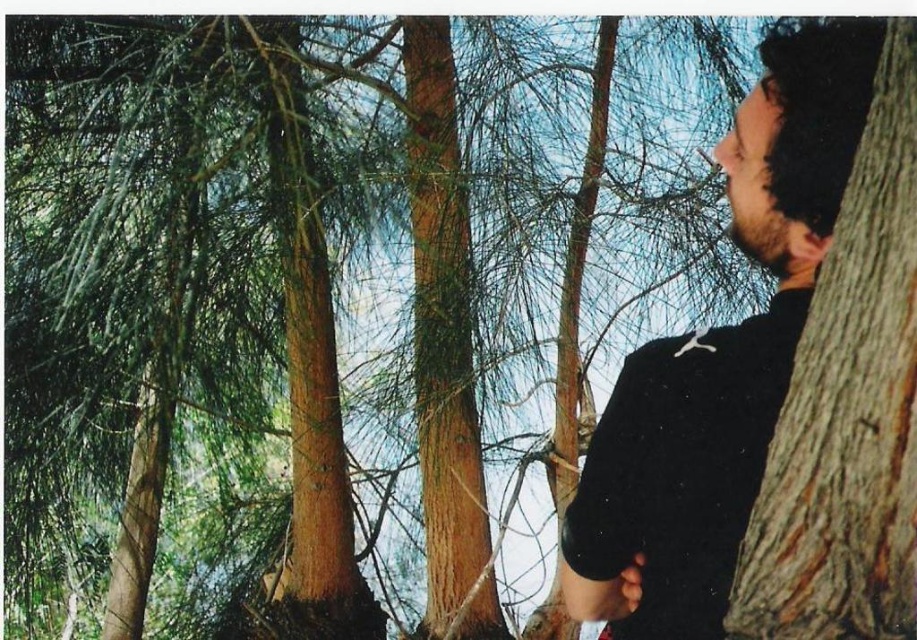
Question: Is black matte shirt at right thinner than brown rough tree trunk at center?

Choices:
 (A) yes
 (B) no

Answer: (B)

Question: Is black matte shirt at right wider than brown rough tree trunk at center?

Choices:
 (A) no
 (B) yes

Answer: (B)

Question: Is black matte shirt at right bigger than brown rough tree trunk at center?

Choices:
 (A) no
 (B) yes

Answer: (A)

Question: Which point is farther to the camera?

Choices:
 (A) black matte shirt at right
 (B) brown rough tree trunk at center

Answer: (B)